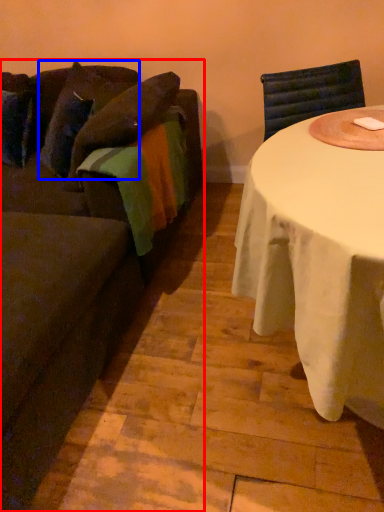
Question: Among these objects, which one is nearest to the camera, studio couch (highlighted by a red box) or pillow (highlighted by a blue box)?

Choices:
 (A) studio couch
 (B) pillow

Answer: (A)